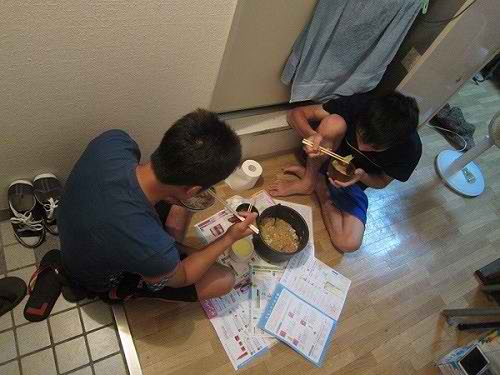
Identify the location of bowls. This screenshot has width=500, height=375. (284, 255), (241, 258), (243, 207), (197, 211), (337, 175).